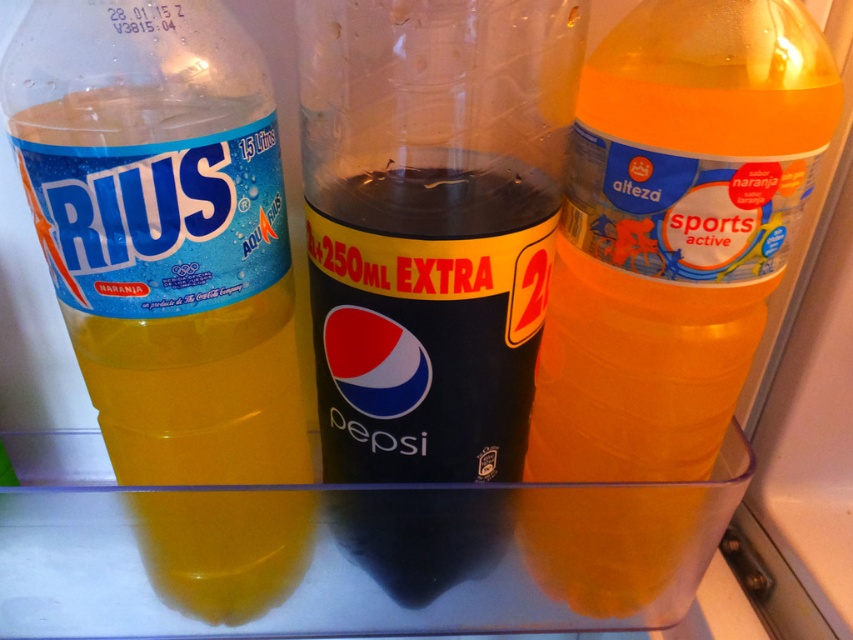
Question: Is translucent plastic bottle at left to the left of black plastic pepsi bottle at center from the viewer's perspective?

Choices:
 (A) yes
 (B) no

Answer: (A)

Question: Which of the following is the closest to the observer?

Choices:
 (A) black plastic pepsi bottle at center
 (B) translucent plastic bottle at left
 (C) translucent orange bottle at right

Answer: (A)

Question: Which is nearer to the translucent orange bottle at right?

Choices:
 (A) black plastic pepsi bottle at center
 (B) translucent plastic bottle at left

Answer: (A)

Question: Does translucent plastic bottle at left appear on the right side of translucent orange bottle at right?

Choices:
 (A) no
 (B) yes

Answer: (A)

Question: Among these points, which one is farthest from the camera?

Choices:
 (A) (258, 323)
 (B) (416, 438)
 (C) (668, 296)

Answer: (A)

Question: Is translucent plastic bottle at left above translucent orange bottle at right?

Choices:
 (A) yes
 (B) no

Answer: (A)